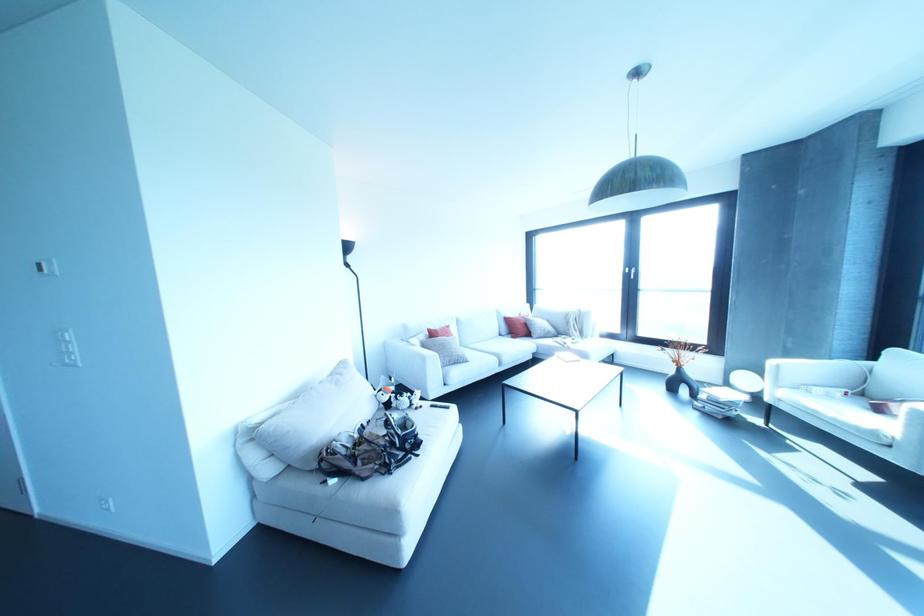
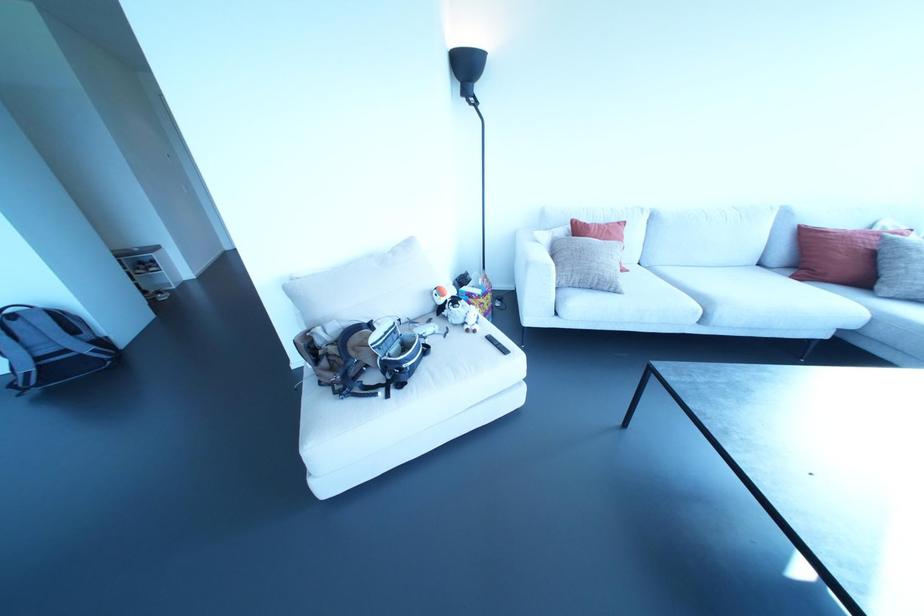
In the second image, find the point that corresponds to pixel 391 387 in the first image.

(477, 291)